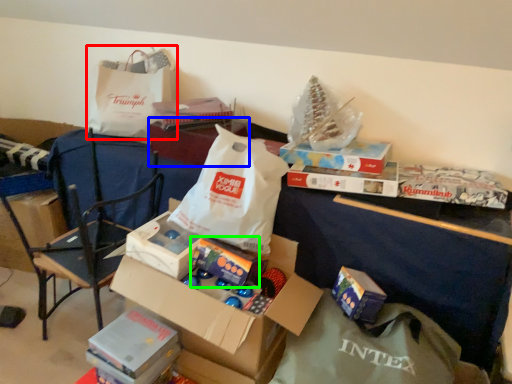
Question: Which is farther away from grocery bag (highlighted by a red box)? storage box (highlighted by a blue box) or gift (highlighted by a green box)?

Choices:
 (A) storage box
 (B) gift

Answer: (B)